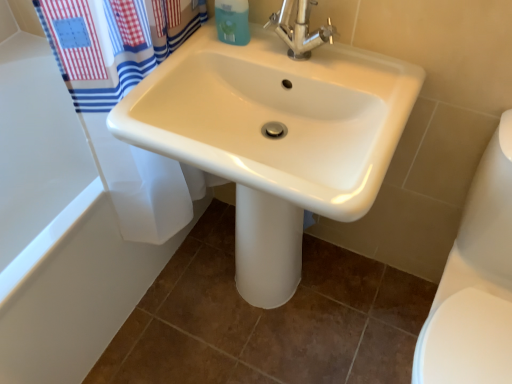
This screenshot has height=384, width=512. In order to click on unoccupied region to the right of chrome metallic faucet at upper center in this screenshot , I will do coord(360,80).